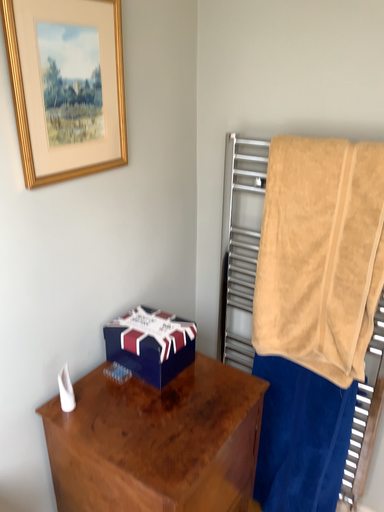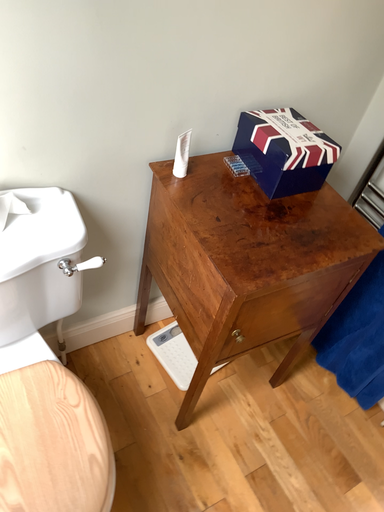
Question: How did the camera likely rotate when shooting the video?

Choices:
 (A) rotated upward
 (B) rotated downward

Answer: (B)